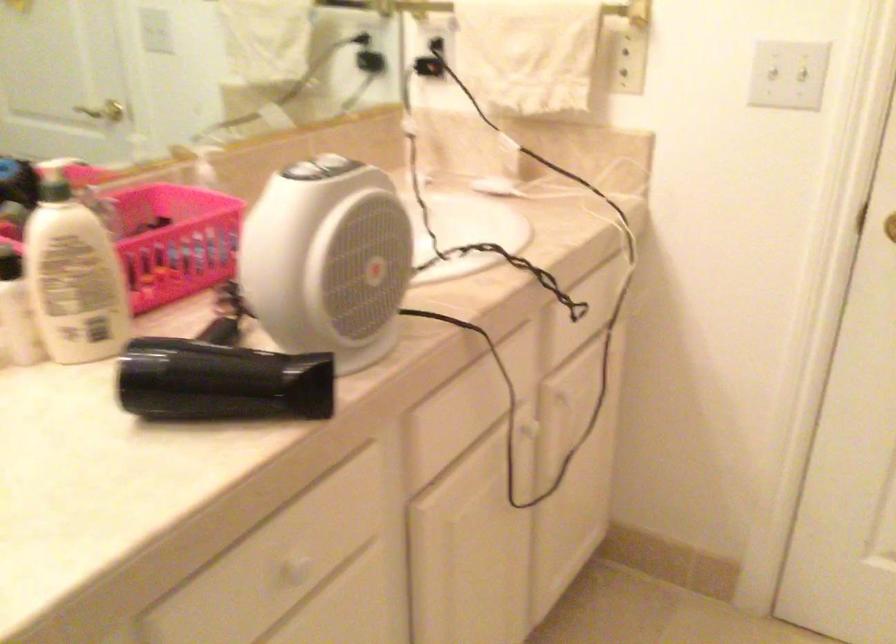
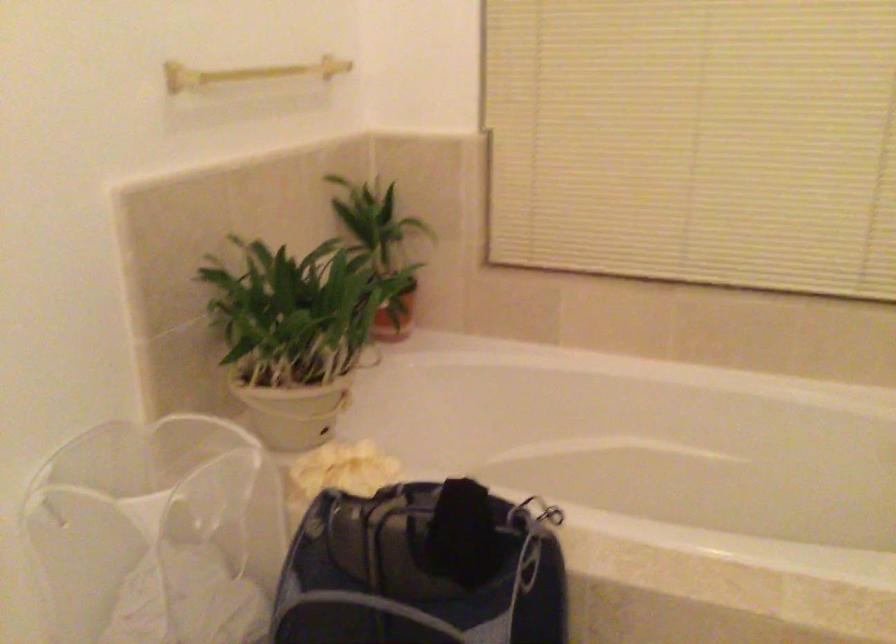
How did the camera likely rotate?

The camera's rotation is toward right-down.